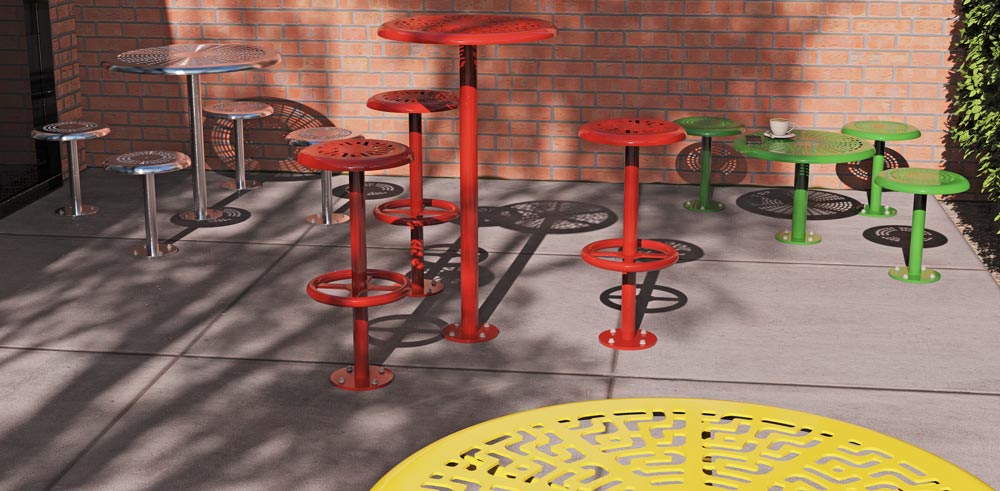
Where is `brick wall`? brick wall is located at coordinates (587, 62).